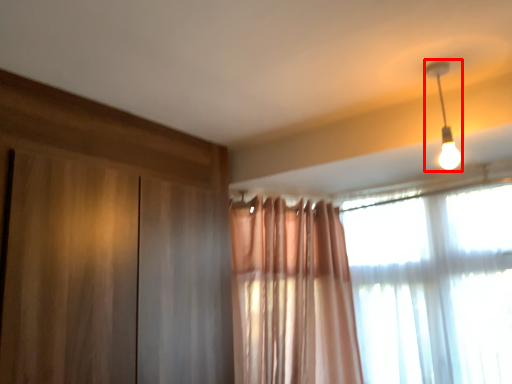
Question: From the image's perspective, considering the relative positions of lamp (annotated by the red box) and window in the image provided, where is lamp (annotated by the red box) located with respect to the staircase?

Choices:
 (A) above
 (B) below

Answer: (A)